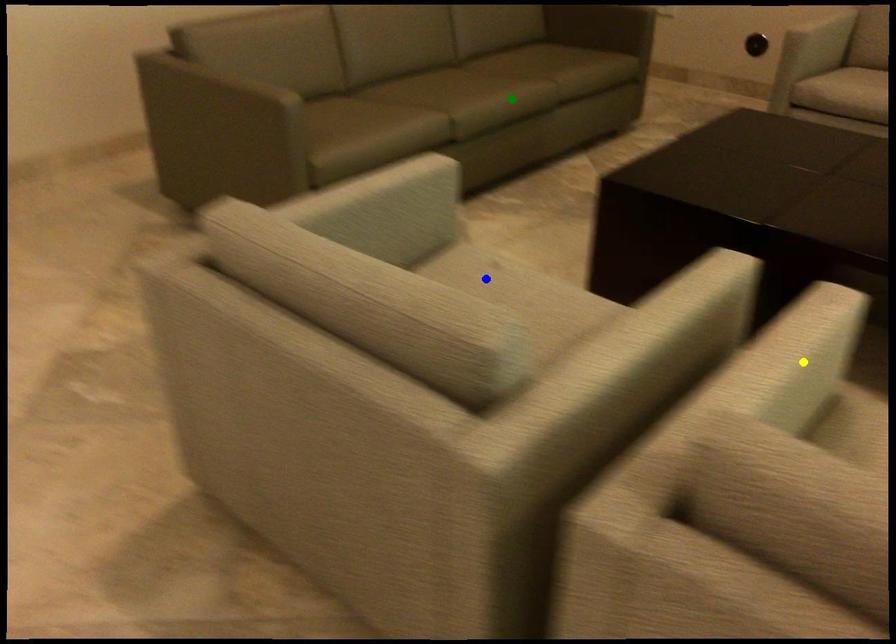
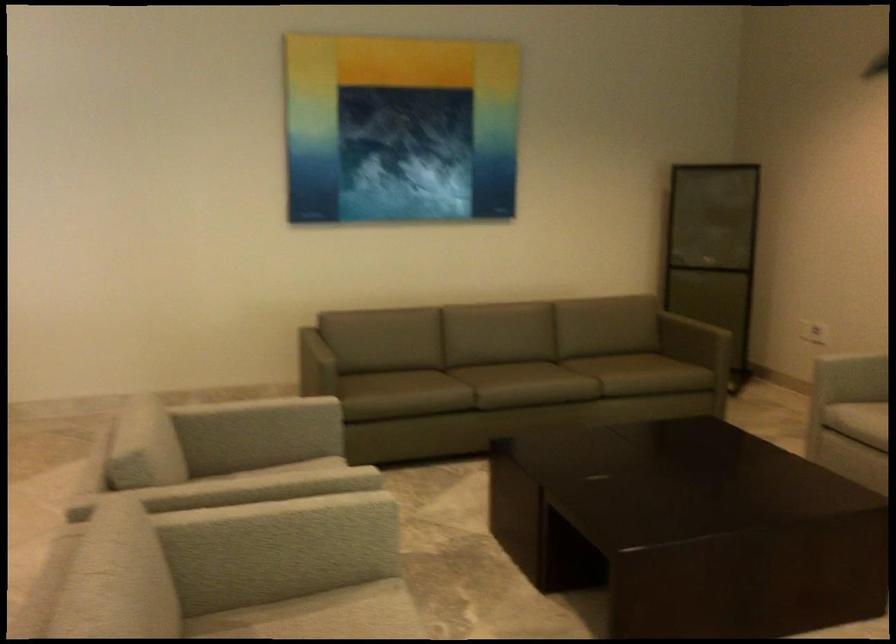
I am providing you with two images of the same scene from different viewpoints. Three points are marked in image1. Which point corresponds to a part or object that is occluded in image2?In image1, three points are marked. Which of them correspond to a part or object that is occluded in image2?Among the three points shown in image1, which one corresponds to a part or object that is no longer visible due to occlusion in image2?

Invisible in image2: blue point.